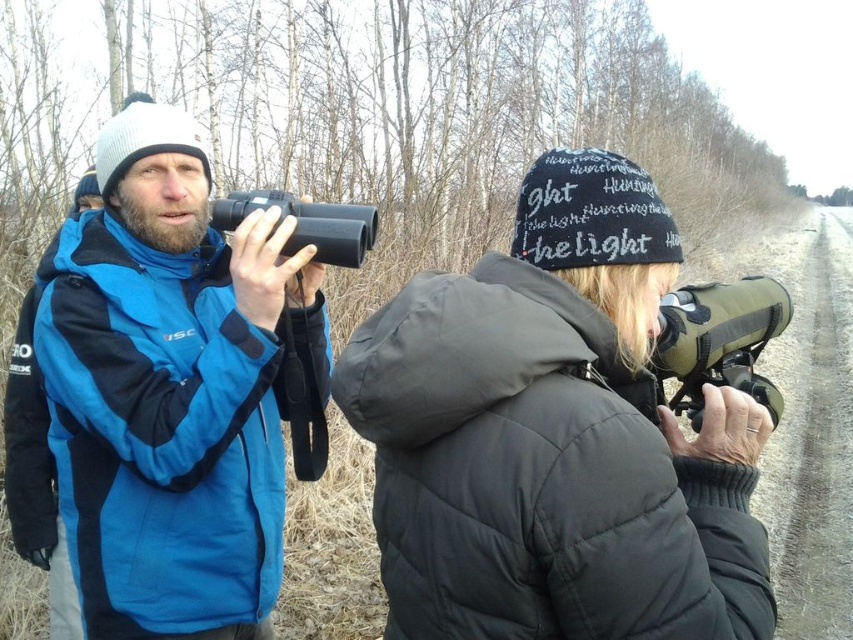
Question: Which object is farther from the camera taking this photo?

Choices:
 (A) blue matte jacket at upper left
 (B) matte green binoculars at right
 (C) black rubber binoculars at left

Answer: (C)

Question: Which of the following is the farthest from the observer?

Choices:
 (A) blue matte jacket at upper left
 (B) matte black jacket at center
 (C) matte green binoculars at right

Answer: (A)

Question: Can you confirm if blue matte jacket at upper left is positioned to the left of matte green binoculars at right?

Choices:
 (A) yes
 (B) no

Answer: (A)

Question: Which object is the farthest from the matte green binoculars at right?

Choices:
 (A) blue matte jacket at upper left
 (B) matte black jacket at center

Answer: (A)

Question: Does blue matte jacket at upper left appear over black rubber binoculars at left?

Choices:
 (A) yes
 (B) no

Answer: (B)

Question: Observing the image, what is the correct spatial positioning of blue matte jacket at upper left in reference to matte green binoculars at right?

Choices:
 (A) below
 (B) above

Answer: (A)